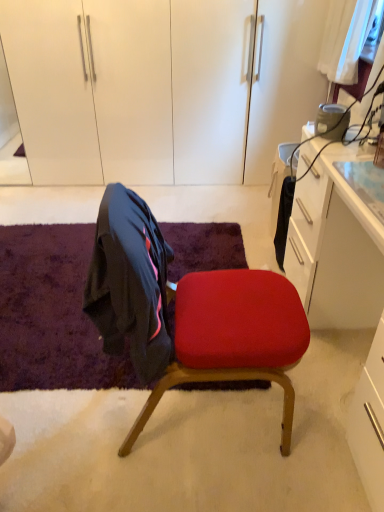
Question: Is velvety purple mat at lower left positioned beyond the bounds of white glossy dresser at upper center?

Choices:
 (A) yes
 (B) no

Answer: (A)

Question: Is velvety purple mat at lower left to the right of white glossy dresser at upper center from the viewer's perspective?

Choices:
 (A) yes
 (B) no

Answer: (B)

Question: Is velvety purple mat at lower left oriented away from white glossy dresser at upper center?

Choices:
 (A) no
 (B) yes

Answer: (A)

Question: From the image's perspective, is velvety purple mat at lower left over white glossy dresser at upper center?

Choices:
 (A) yes
 (B) no

Answer: (B)

Question: Can you confirm if velvety purple mat at lower left is wider than white glossy dresser at upper center?

Choices:
 (A) no
 (B) yes

Answer: (B)

Question: Would you consider velvety purple mat at lower left to be distant from white glossy dresser at upper center?

Choices:
 (A) no
 (B) yes

Answer: (B)

Question: From a real-world perspective, is white glossy dresser at upper center physically above velvet red chair at center?

Choices:
 (A) no
 (B) yes

Answer: (B)

Question: From a real-world perspective, is white glossy dresser at upper center under velvet red chair at center?

Choices:
 (A) no
 (B) yes

Answer: (A)

Question: Is white glossy dresser at upper center to the right of velvet red chair at center from the viewer's perspective?

Choices:
 (A) no
 (B) yes

Answer: (A)

Question: Can you confirm if white glossy dresser at upper center is smaller than velvet red chair at center?

Choices:
 (A) yes
 (B) no

Answer: (B)

Question: Is white glossy dresser at upper center directly adjacent to velvet red chair at center?

Choices:
 (A) no
 (B) yes

Answer: (A)

Question: Considering the relative sizes of white glossy dresser at upper center and velvet red chair at center in the image provided, is white glossy dresser at upper center thinner than velvet red chair at center?

Choices:
 (A) no
 (B) yes

Answer: (A)

Question: Is white glossy dresser at upper center not close to velvety purple mat at lower left?

Choices:
 (A) yes
 (B) no

Answer: (A)